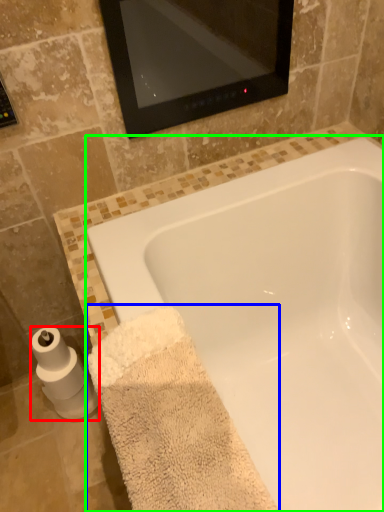
Question: Based on their relative distances, which object is nearer to toilet paper (highlighted by a red box)? Choose from bath towel (highlighted by a blue box) and bathtub (highlighted by a green box).

Choices:
 (A) bath towel
 (B) bathtub

Answer: (A)